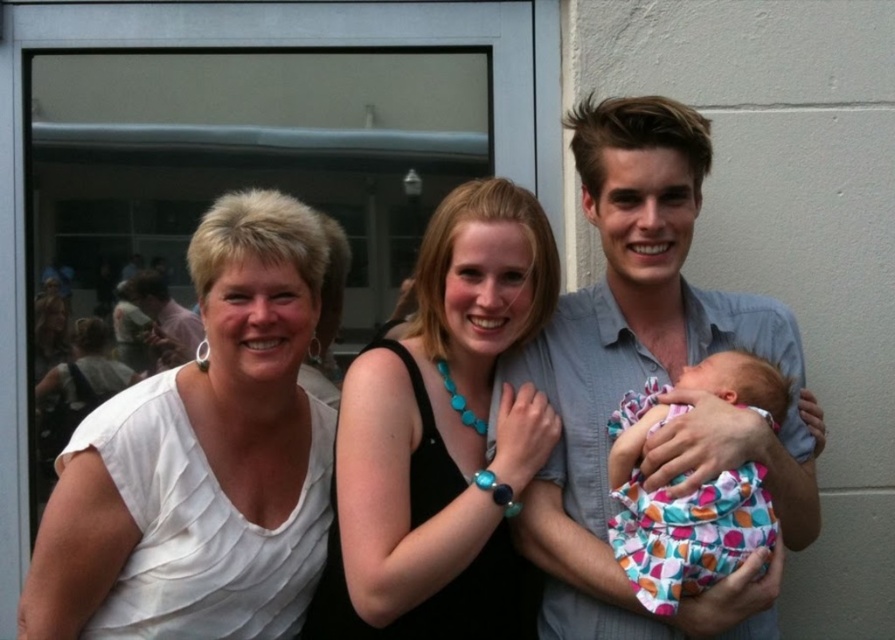
Does white matte shirt at left appear on the right side of black matte dress at center?

In fact, white matte shirt at left is to the left of black matte dress at center.

Is point (124, 412) positioned before point (484, 513)?

No.

This screenshot has width=895, height=640. I want to click on white matte shirt at left, so click(201, 460).

Is white matte shirt at left behind polka dot fabric baby at center?

That is True.

In the scene shown: Which is more to the right, white matte shirt at left or polka dot fabric baby at center?

polka dot fabric baby at center is more to the right.

Does point (156, 577) come in front of point (614, 493)?

No.

Identify the location of white matte shirt at left. (201, 460).

Is point (416, 305) behind point (131, 292)?

Yes, point (416, 305) is behind point (131, 292).

Is black matte dress at center above matte white shirt at left?

Actually, black matte dress at center is below matte white shirt at left.

Who is more forward, (492, 490) or (175, 308)?

Point (492, 490)

Identify the location of black matte dress at center. The image size is (895, 640). (442, 438).